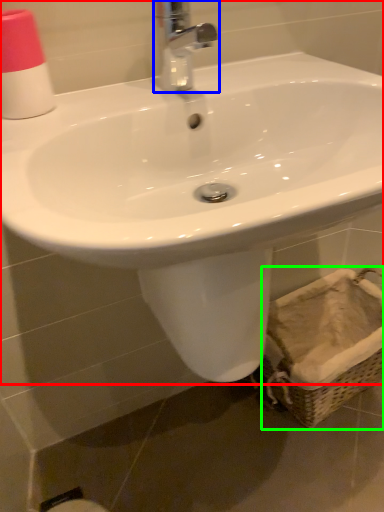
Question: Estimate the real-world distances between objects in this image. Which object is closer to sink (highlighted by a red box), tap (highlighted by a blue box) or basket (highlighted by a green box)?

Choices:
 (A) tap
 (B) basket

Answer: (A)